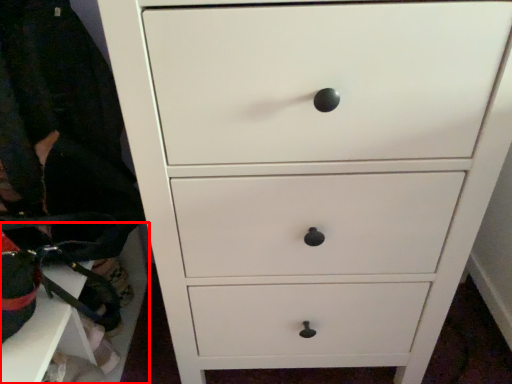
Question: From the image's perspective, what is the correct spatial relationship of cabinetry (annotated by the red box) in relation to clothing?

Choices:
 (A) below
 (B) above

Answer: (A)